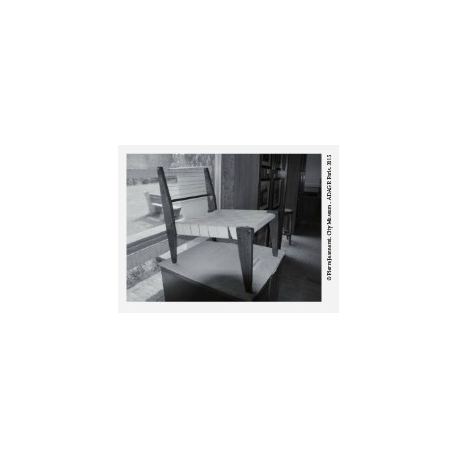
The height and width of the screenshot is (458, 458). In order to click on bookcase in this screenshot , I will do coord(271,167), coord(266,207).